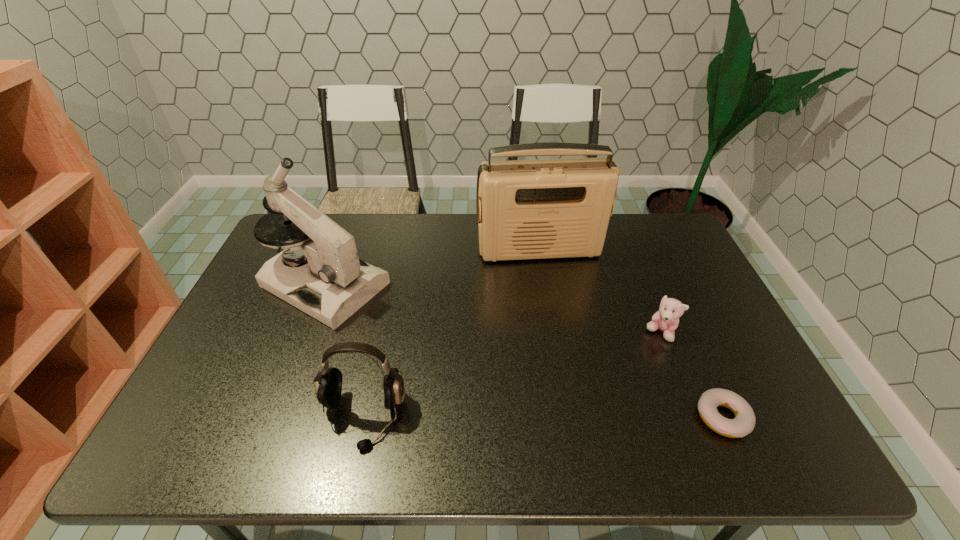
The height and width of the screenshot is (540, 960). I want to click on free space located 0.120m at the face of the teddy bear, so click(617, 356).

The width and height of the screenshot is (960, 540). Find the location of `vacant region located at the face of the teddy bear`. vacant region located at the face of the teddy bear is located at coordinates (593, 369).

Locate an element on the screen. This screenshot has height=540, width=960. vacant area situated on the front-facing side of the radio receiver is located at coordinates (576, 362).

This screenshot has height=540, width=960. What are the coordinates of `free space located on the front-facing side of the radio receiver` in the screenshot? It's located at (558, 300).

Find the location of a particular element. vacant space located 0.400m on the front-facing side of the radio receiver is located at coordinates (577, 366).

Where is `microscope that is at the far edge`? Image resolution: width=960 pixels, height=540 pixels. microscope that is at the far edge is located at coordinates (335, 283).

At what (x,y) coordinates should I click in order to perform the action: click on radio receiver present at the far edge. Please return your answer as a coordinate pair (x, y). This screenshot has width=960, height=540. Looking at the image, I should click on (550, 208).

At what (x,y) coordinates should I click in order to perform the action: click on headset positioned at the near edge. Please return your answer as a coordinate pair (x, y). This screenshot has width=960, height=540. Looking at the image, I should click on (328, 387).

At what (x,y) coordinates should I click in order to perform the action: click on doughnut situated at the near edge. Please return your answer as a coordinate pair (x, y). Looking at the image, I should click on (744, 422).

Image resolution: width=960 pixels, height=540 pixels. Find the location of `object at the left edge`. object at the left edge is located at coordinates (335, 283).